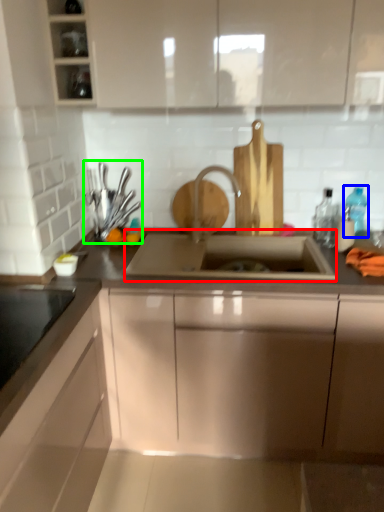
Question: Based on their relative distances, which object is nearer to sink (highlighted by a red box)? Choose from bottle (highlighted by a blue box) and appliance (highlighted by a green box).

Choices:
 (A) bottle
 (B) appliance

Answer: (B)